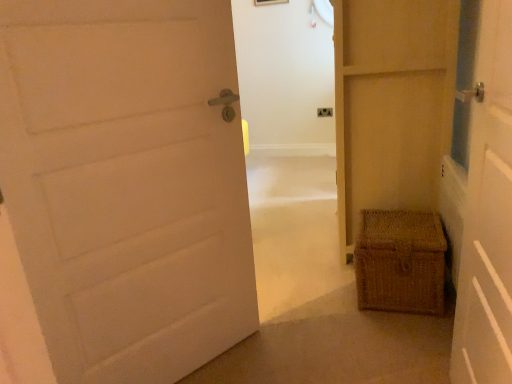
Question: Are wooden picture frame at upper center and matte beige door at center, the third door when ordered from left to right, located far from each other?

Choices:
 (A) no
 (B) yes

Answer: (B)

Question: Considering the relative sizes of wooden picture frame at upper center and matte beige door at center, which is the 1th door from right to left, in the image provided, is wooden picture frame at upper center taller than matte beige door at center, which is the 1th door from right to left,?

Choices:
 (A) no
 (B) yes

Answer: (A)

Question: Considering the relative sizes of wooden picture frame at upper center and matte beige door at center, which is the 1th door from right to left, in the image provided, is wooden picture frame at upper center thinner than matte beige door at center, which is the 1th door from right to left,?

Choices:
 (A) yes
 (B) no

Answer: (A)

Question: Is wooden picture frame at upper center next to matte beige door at center, which is the 1th door from right to left, and touching it?

Choices:
 (A) no
 (B) yes

Answer: (A)

Question: From the image's perspective, is wooden picture frame at upper center over matte beige door at center, the third door when ordered from left to right?

Choices:
 (A) yes
 (B) no

Answer: (A)

Question: Is woven brown basket at right to the left or to the right of matte beige door at center, which is the 1th door from right to left, in the image?

Choices:
 (A) right
 (B) left

Answer: (B)

Question: In terms of height, does woven brown basket at right look taller or shorter compared to matte beige door at center, which is the 1th door from right to left?

Choices:
 (A) tall
 (B) short

Answer: (B)

Question: From the image's perspective, is woven brown basket at right above or below matte beige door at center, the third door when ordered from left to right?

Choices:
 (A) above
 (B) below

Answer: (B)

Question: From a real-world perspective, is woven brown basket at right above or below matte beige door at center, the third door when ordered from left to right?

Choices:
 (A) above
 (B) below

Answer: (B)

Question: Visually, is white matte door at left, the 3th door when ordered from right to left, positioned to the left or to the right of matte beige door at center, which is the 1th door from right to left?

Choices:
 (A) left
 (B) right

Answer: (A)

Question: Relative to matte beige door at center, the third door when ordered from left to right, is white matte door at left, the 3th door when ordered from right to left, in front or behind?

Choices:
 (A) front
 (B) behind

Answer: (A)

Question: From a real-world perspective, relative to matte beige door at center, the third door when ordered from left to right, is white matte door at left, the first door viewed from the left, vertically above or below?

Choices:
 (A) above
 (B) below

Answer: (B)

Question: In terms of width, does white matte door at left, the first door viewed from the left, look wider or thinner when compared to matte beige door at center, the third door when ordered from left to right?

Choices:
 (A) thin
 (B) wide

Answer: (A)

Question: Looking at the image, does matte plastic electrical outlet at center seem bigger or smaller compared to white matte door at left, the first door viewed from the left?

Choices:
 (A) small
 (B) big

Answer: (A)

Question: Considering the positions of point (324, 114) and point (109, 289), is point (324, 114) closer or farther from the camera than point (109, 289)?

Choices:
 (A) farther
 (B) closer

Answer: (A)